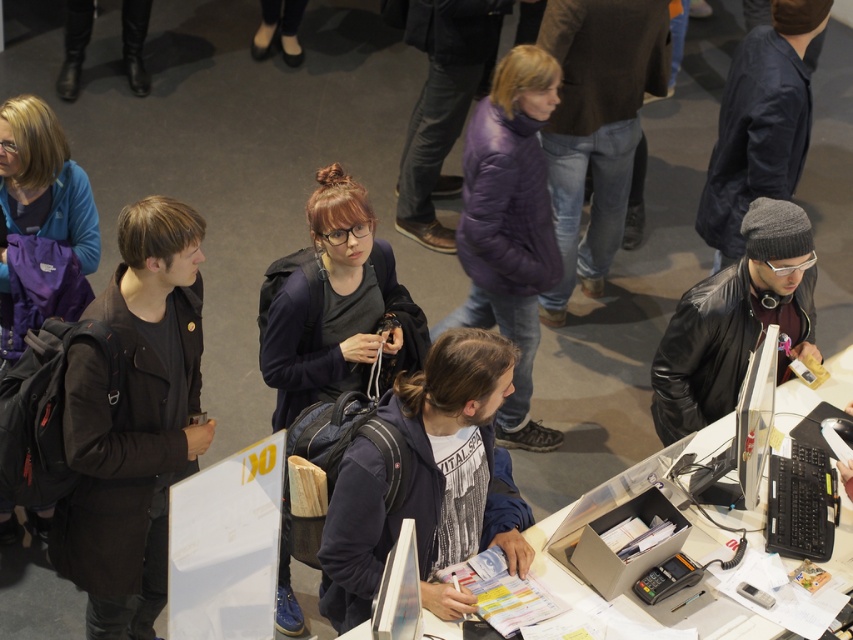
Question: Can you confirm if dark gray backpack at center is smaller than black leather jacket at center?

Choices:
 (A) yes
 (B) no

Answer: (B)

Question: Which point is farther to the camera?

Choices:
 (A) dark blue jacket at center
 (B) purple puffy jacket at center
 (C) black leather jacket at center
 (D) dark brown leather jacket at left

Answer: (B)

Question: Based on their relative distances, which object is nearer to the dark blue jacket at center?

Choices:
 (A) denim jeans at center
 (B) dark brown leather jacket at left
 (C) black leather jacket at center

Answer: (B)

Question: Considering the relative positions of dark gray backpack at center and black leather jacket at center in the image provided, where is dark gray backpack at center located with respect to black leather jacket at center?

Choices:
 (A) right
 (B) left

Answer: (B)

Question: Which object is farther from the camera taking this photo?

Choices:
 (A) dark blue coat at upper right
 (B) dark blue jacket at center
 (C) black leather jacket at center

Answer: (A)

Question: Does dark brown leather jacket at left come in front of denim jeans at center?

Choices:
 (A) yes
 (B) no

Answer: (A)